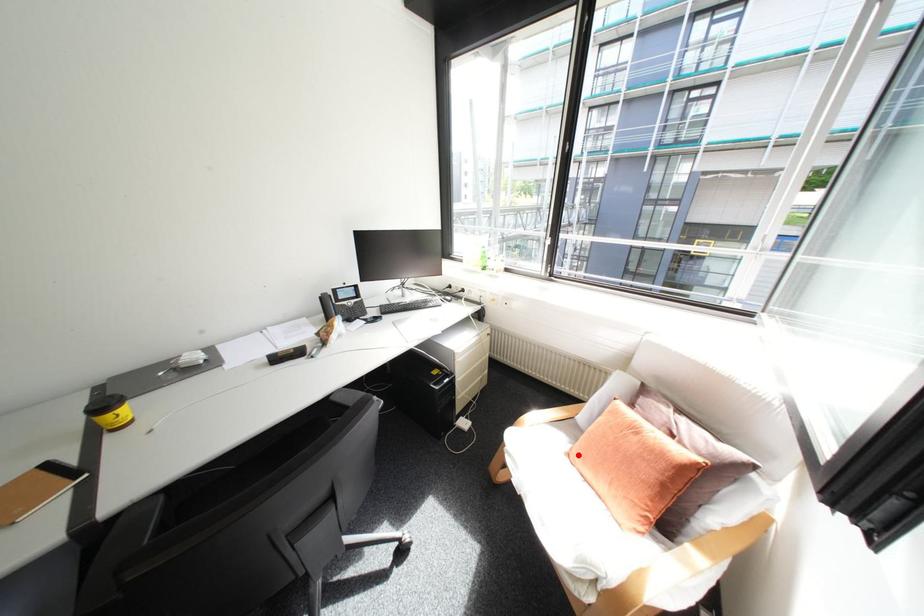
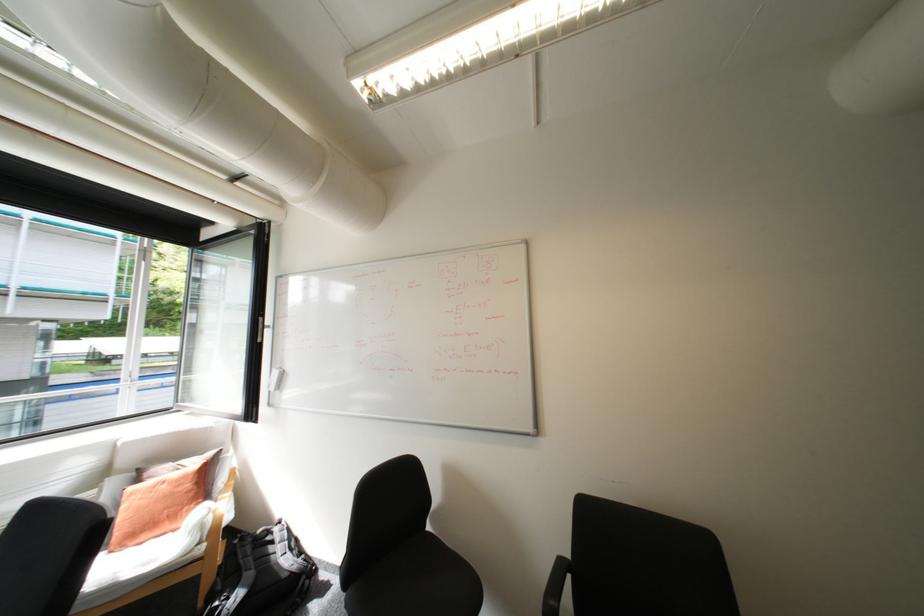
Question: I am providing you with two images of the same scene from different viewpoints. In image1, a red point is highlighted. Considering the same 3D point in image2, which of the following is correct?

Choices:
 (A) It is closer
 (B) It is farther

Answer: (B)